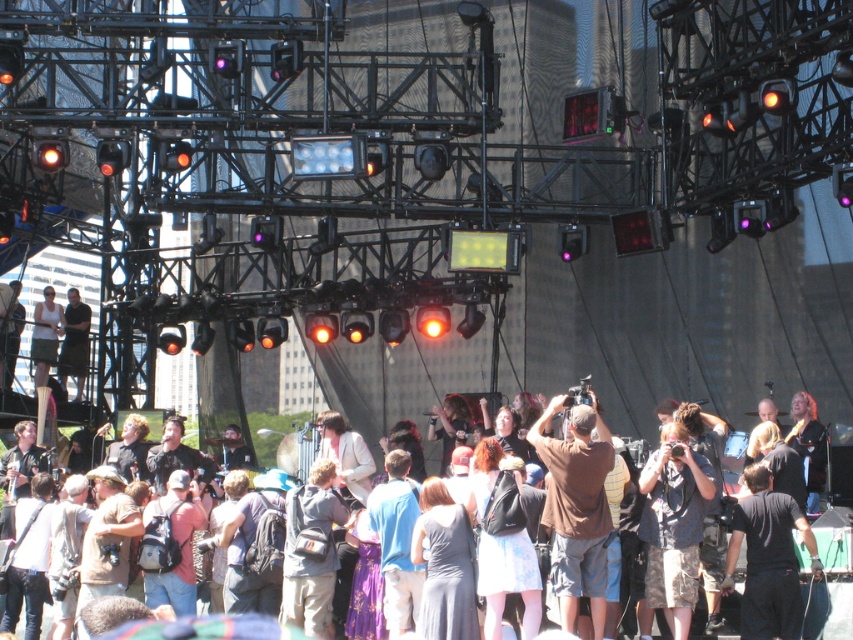
Is brown cotton t-shirt at center positioned behind multicolored casual clothing at center?

Yes, it is.

Between brown cotton t-shirt at center and multicolored casual clothing at center, which one has less height?

Standing shorter between the two is brown cotton t-shirt at center.

Which is behind, point (590, 404) or point (619, 468)?

Point (590, 404)

The width and height of the screenshot is (853, 640). I want to click on brown cotton t-shirt at center, so click(576, 508).

Is point (666, 566) positioned behind point (759, 563)?

Yes, it is.

Can you confirm if camo shorts at center is positioned to the right of black cotton shirt at center?

No, camo shorts at center is not to the right of black cotton shirt at center.

Which is behind, point (660, 502) or point (755, 616)?

The point (660, 502) is behind.

Image resolution: width=853 pixels, height=640 pixels. Identify the location of camo shorts at center. (672, 524).

Is the position of brown cotton t-shirt at center more distant than that of camo shorts at center?

That is False.

Who is positioned more to the left, brown cotton t-shirt at center or camo shorts at center?

From the viewer's perspective, brown cotton t-shirt at center appears more on the left side.

Which is in front, point (593, 417) or point (662, 461)?

Point (593, 417) is more forward.

Locate an element on the screen. This screenshot has width=853, height=640. brown cotton t-shirt at center is located at coordinates (576, 508).